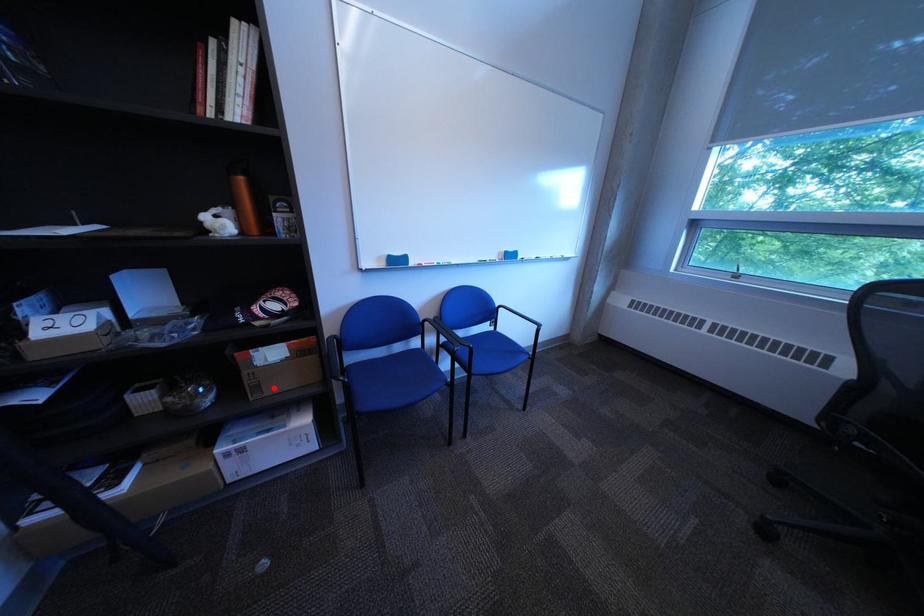
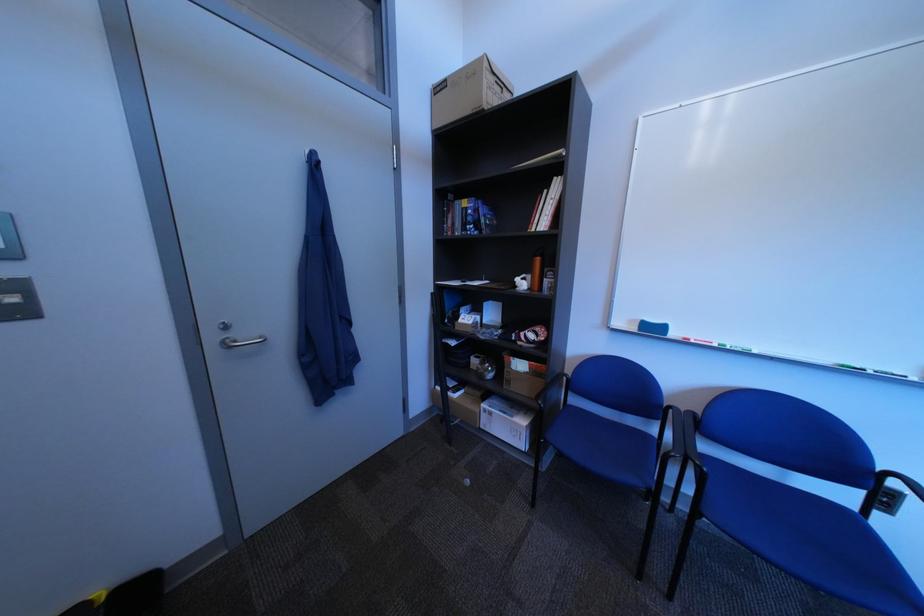
The point at the highlighted location is marked in the first image. Where is the corresponding point in the second image?

(525, 383)